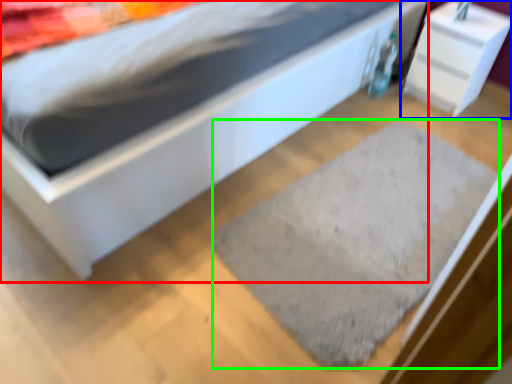
Question: Estimate the real-world distances between objects in this image. Which object is farther from bed (highlighted by a red box), nightstand (highlighted by a blue box) or doormat (highlighted by a green box)?

Choices:
 (A) nightstand
 (B) doormat

Answer: (A)